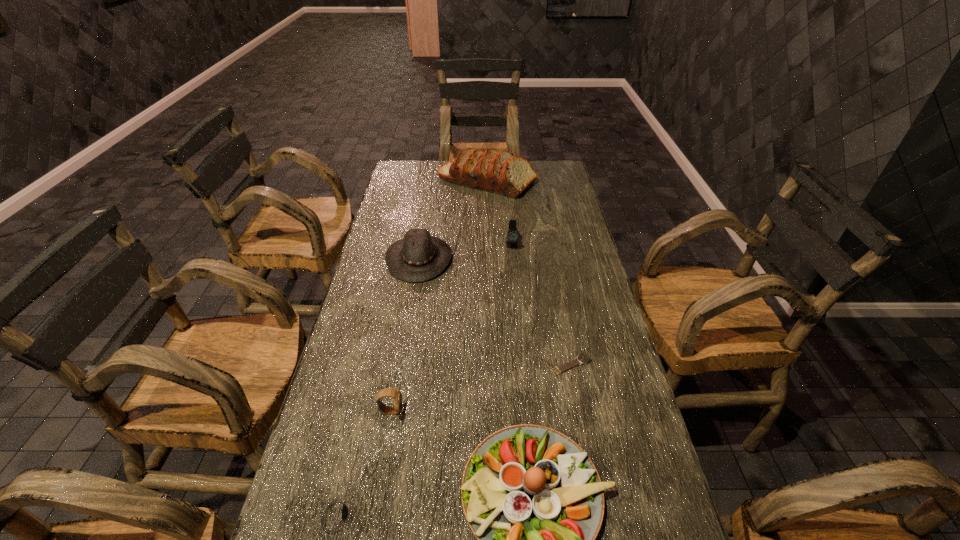
The image size is (960, 540). Identify the location of bread. (501, 172).

Locate an element on the screen. The width and height of the screenshot is (960, 540). the tallest object is located at coordinates (501, 172).

The image size is (960, 540). In order to click on the second watch from right to left in this screenshot , I will do `click(513, 235)`.

Locate an element on the screen. Image resolution: width=960 pixels, height=540 pixels. the tallest watch is located at coordinates coord(513,235).

Identify the location of hat. (419, 257).

At what (x,y) coordinates should I click in order to perform the action: click on the third shortest object. Please return your answer as a coordinate pair (x, y). The image size is (960, 540). Looking at the image, I should click on (387, 392).

Find the location of a particular element. The height and width of the screenshot is (540, 960). the third shortest watch is located at coordinates click(x=387, y=392).

You are a GUI agent. You are given a task and a screenshot of the screen. Output one action in this format:
    pyautogui.click(x=<x>, y=<y>)
    Task: Click on the fourth nearest object
    
    Given the screenshot: What is the action you would take?
    pyautogui.click(x=584, y=358)

You are a GUI agent. You are given a task and a screenshot of the screen. Output one action in this format:
    pyautogui.click(x=<x>, y=<y>)
    Task: Click on the second farthest watch
    This screenshot has height=540, width=960.
    Given the screenshot: What is the action you would take?
    pyautogui.click(x=584, y=358)

What are the coordinates of `vacant point located on the front of the tallest object` in the screenshot? It's located at (489, 224).